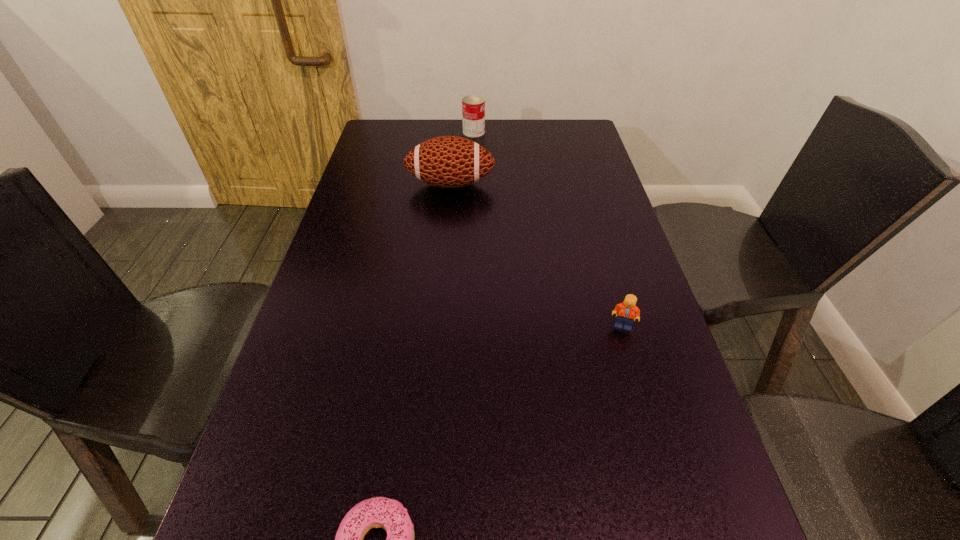
This screenshot has width=960, height=540. What are the coordinates of `the closest object to the rightmost object` in the screenshot? It's located at (378, 512).

Identify which object is located as the nearest to the farthest object. Please provide its 2D coordinates. Your answer should be formatted as a tuple, i.e. [(x, y)], where the tuple contains the x and y coordinates of a point satisfying the conditions above.

[(446, 161)]